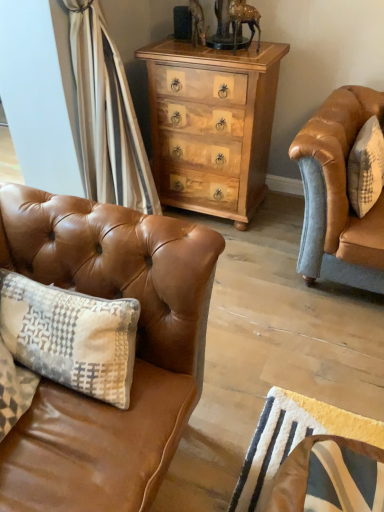
Question: Looking at the image, does white textured pillow at right seem bigger or smaller compared to leather swivel chair at lower right?

Choices:
 (A) small
 (B) big

Answer: (A)

Question: Choose the correct answer: Is white textured pillow at right inside leather swivel chair at lower right or outside it?

Choices:
 (A) outside
 (B) inside

Answer: (A)

Question: Considering the real-world distances, which object is closest to the white textured pillow at right?

Choices:
 (A) light brown wood chest of drawers at center
 (B) saddle brown leather couch at left
 (C) leather swivel chair at lower right

Answer: (A)

Question: Estimate the real-world distances between objects in this image. Which object is farther from the leather swivel chair at lower right?

Choices:
 (A) light brown wood chest of drawers at center
 (B) saddle brown leather couch at left
 (C) white textured pillow at right

Answer: (A)